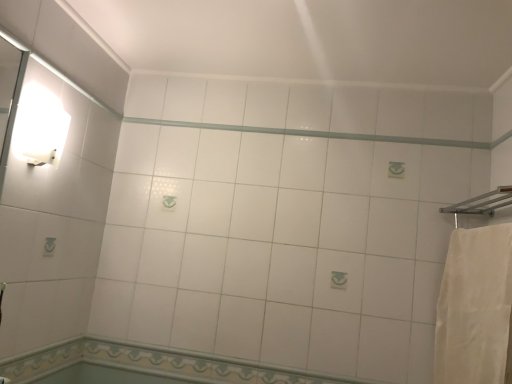
At what (x,y) coordinates should I click in order to perform the action: click on white glossy wall sconce at upper left. Please return your answer as a coordinate pair (x, y). Image resolution: width=512 pixels, height=384 pixels. Looking at the image, I should click on (40, 126).

Where is `white glossy tile at lower center, arranged as the 1th bath when viewed from the top`? white glossy tile at lower center, arranged as the 1th bath when viewed from the top is located at coordinates (153, 364).

Is white glossy tile at lower center, the 2th bath ordered from the bottom, beside decorative tile border at lower center, which is the 2th bath in top-to-bottom order?

Absolutely, white glossy tile at lower center, the 2th bath ordered from the bottom, is next to and touching decorative tile border at lower center, which is the 2th bath in top-to-bottom order.

From a real-world perspective, which is physically above, white glossy tile at lower center, the 2th bath ordered from the bottom, or decorative tile border at lower center, the 1th bath from the bottom?

In real-world perspective, white glossy tile at lower center, the 2th bath ordered from the bottom, is above.

Would you say white glossy tile at lower center, the 2th bath ordered from the bottom, is inside or outside decorative tile border at lower center, which is the 2th bath in top-to-bottom order?

white glossy tile at lower center, the 2th bath ordered from the bottom, is not inside decorative tile border at lower center, which is the 2th bath in top-to-bottom order, it's outside.

Visually, is white cotton bath towel at right positioned to the left or to the right of white glossy tile at lower center, the 2th bath ordered from the bottom?

In the image, white cotton bath towel at right appears on the right side of white glossy tile at lower center, the 2th bath ordered from the bottom.

Measure the distance between white cotton bath towel at right and white glossy tile at lower center, arranged as the 1th bath when viewed from the top.

white cotton bath towel at right and white glossy tile at lower center, arranged as the 1th bath when viewed from the top, are 28.06 inches apart from each other.

Considering the points (497, 263) and (250, 375), which point is in front, point (497, 263) or point (250, 375)?

The point (497, 263) is more forward.

From the image's perspective, relative to white glossy tile at lower center, the 2th bath ordered from the bottom, is white cotton bath towel at right above or below?

white cotton bath towel at right is situated higher than white glossy tile at lower center, the 2th bath ordered from the bottom, in the image.

From a real-world perspective, is white glossy wall sconce at upper left under white glossy tile at lower center, the 2th bath ordered from the bottom?

No, from a real-world perspective, white glossy wall sconce at upper left is not under white glossy tile at lower center, the 2th bath ordered from the bottom.

Can you see white glossy wall sconce at upper left touching white glossy tile at lower center, arranged as the 1th bath when viewed from the top?

No, white glossy wall sconce at upper left is not with white glossy tile at lower center, arranged as the 1th bath when viewed from the top.

Considering their positions, is white glossy wall sconce at upper left located in front of or behind white glossy tile at lower center, the 2th bath ordered from the bottom?

white glossy wall sconce at upper left is positioned closer to the viewer than white glossy tile at lower center, the 2th bath ordered from the bottom.

Measure the distance between white glossy wall sconce at upper left and white glossy tile at lower center, the 2th bath ordered from the bottom.

white glossy wall sconce at upper left and white glossy tile at lower center, the 2th bath ordered from the bottom, are 34.68 inches apart from each other.

Is white glossy tile at lower center, the 2th bath ordered from the bottom, wider or thinner than white glossy wall sconce at upper left?

Considering their sizes, white glossy tile at lower center, the 2th bath ordered from the bottom, looks slimmer than white glossy wall sconce at upper left.

From the white glossy wall sconce at upper left, count 2nd bath to the right and point to it. Please provide its 2D coordinates.

[(153, 364)]

From a real-world perspective, is white glossy tile at lower center, arranged as the 1th bath when viewed from the top, positioned above or below white glossy wall sconce at upper left?

In terms of real-world spatial position, white glossy tile at lower center, arranged as the 1th bath when viewed from the top, is below white glossy wall sconce at upper left.

Is white glossy tile at lower center, the 2th bath ordered from the bottom, looking in the opposite direction of white glossy wall sconce at upper left?

No.

Where is `light fixture lying in front of the decorative tile border at lower center, the 1th bath from the bottom`? light fixture lying in front of the decorative tile border at lower center, the 1th bath from the bottom is located at coordinates (40, 126).

Considering the positions of objects decorative tile border at lower center, which is the 2th bath in top-to-bottom order, and white glossy wall sconce at upper left in the image provided, who is more to the left, decorative tile border at lower center, which is the 2th bath in top-to-bottom order, or white glossy wall sconce at upper left?

white glossy wall sconce at upper left is more to the left.

Who is shorter, decorative tile border at lower center, which is the 2th bath in top-to-bottom order, or white glossy wall sconce at upper left?

Standing shorter between the two is decorative tile border at lower center, which is the 2th bath in top-to-bottom order.

From a real-world perspective, between decorative tile border at lower center, which is the 2th bath in top-to-bottom order, and white glossy wall sconce at upper left, who is vertically lower?

decorative tile border at lower center, which is the 2th bath in top-to-bottom order, from a real-world perspective.

From a real-world perspective, which bath is the 1st one underneath the white glossy beam at center? Please provide its 2D coordinates.

[(153, 364)]

Is white glossy tile at lower center, the 2th bath ordered from the bottom, oriented away from white glossy beam at center?

No, white glossy beam at center is not at the back of white glossy tile at lower center, the 2th bath ordered from the bottom.

Is point (191, 379) positioned behind point (147, 121)?

No, (191, 379) is closer to viewer.

Consider the image. Which of these two, white glossy tile at lower center, the 2th bath ordered from the bottom, or white glossy beam at center, stands shorter?

Standing shorter between the two is white glossy beam at center.

Would you say white glossy beam at center is outside white glossy tile at lower center, the 2th bath ordered from the bottom?

Yes, white glossy beam at center is outside of white glossy tile at lower center, the 2th bath ordered from the bottom.

Is point (198, 128) positioned in front of point (53, 359)?

No, (198, 128) is further to viewer.

Looking at this image, is there a large distance between white glossy beam at center and white glossy tile at lower center, arranged as the 1th bath when viewed from the top?

white glossy beam at center is positioned a significant distance from white glossy tile at lower center, arranged as the 1th bath when viewed from the top.

Image resolution: width=512 pixels, height=384 pixels. Identify the location of bath that is below the white glossy tile at lower center, arranged as the 1th bath when viewed from the top (from the image's perspective). (110, 375).

Identify the location of bath towel lying in front of the white glossy tile at lower center, the 2th bath ordered from the bottom. (475, 308).

Based on their spatial positions, is white cotton bath towel at right or white glossy tile at lower center, arranged as the 1th bath when viewed from the top, further from decorative tile border at lower center, which is the 2th bath in top-to-bottom order?

white cotton bath towel at right is further to decorative tile border at lower center, which is the 2th bath in top-to-bottom order.

In the scene shown: Estimate the real-world distances between objects in this image. Which object is further from white glossy beam at center, decorative tile border at lower center, which is the 2th bath in top-to-bottom order, or white glossy tile at lower center, arranged as the 1th bath when viewed from the top?

decorative tile border at lower center, which is the 2th bath in top-to-bottom order, is further to white glossy beam at center.

Considering their positions, is decorative tile border at lower center, which is the 2th bath in top-to-bottom order, positioned closer to white cotton bath towel at right than white glossy beam at center?

Based on the image, white glossy beam at center appears to be nearer to white cotton bath towel at right.

From the image, which object appears to be nearer to white glossy wall sconce at upper left, decorative tile border at lower center, the 1th bath from the bottom, or white glossy beam at center?

white glossy beam at center lies closer to white glossy wall sconce at upper left than the other object.

Looking at the image, which one is located closer to white glossy wall sconce at upper left, white glossy tile at lower center, arranged as the 1th bath when viewed from the top, or white cotton bath towel at right?

white glossy tile at lower center, arranged as the 1th bath when viewed from the top, is positioned closer to the anchor white glossy wall sconce at upper left.

Estimate the real-world distances between objects in this image. Which object is closer to white glossy wall sconce at upper left, white cotton bath towel at right or white glossy tile at lower center, the 2th bath ordered from the bottom?

white glossy tile at lower center, the 2th bath ordered from the bottom.

Based on their spatial positions, is white glossy wall sconce at upper left or white glossy tile at lower center, the 2th bath ordered from the bottom, closer to decorative tile border at lower center, which is the 2th bath in top-to-bottom order?

white glossy tile at lower center, the 2th bath ordered from the bottom.

From the image, which object appears to be nearer to white glossy tile at lower center, arranged as the 1th bath when viewed from the top, white glossy beam at center or decorative tile border at lower center, which is the 2th bath in top-to-bottom order?

Among the two, decorative tile border at lower center, which is the 2th bath in top-to-bottom order, is located nearer to white glossy tile at lower center, arranged as the 1th bath when viewed from the top.

The height and width of the screenshot is (384, 512). Find the location of `bath towel between white glossy beam at center and white glossy tile at lower center, the 2th bath ordered from the bottom, in the vertical direction`. bath towel between white glossy beam at center and white glossy tile at lower center, the 2th bath ordered from the bottom, in the vertical direction is located at coordinates (475, 308).

Image resolution: width=512 pixels, height=384 pixels. Find the location of `beam between decorative tile border at lower center, the 1th bath from the bottom, and white cotton bath towel at right`. beam between decorative tile border at lower center, the 1th bath from the bottom, and white cotton bath towel at right is located at coordinates (314, 133).

Find the location of a particular element. bath between white glossy beam at center and decorative tile border at lower center, which is the 2th bath in top-to-bottom order, in the up-down direction is located at coordinates (153, 364).

Find the location of `bath located between decorative tile border at lower center, which is the 2th bath in top-to-bottom order, and white cotton bath towel at right in the left-right direction`. bath located between decorative tile border at lower center, which is the 2th bath in top-to-bottom order, and white cotton bath towel at right in the left-right direction is located at coordinates click(153, 364).